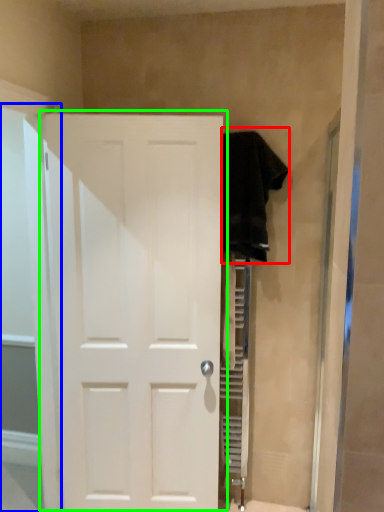
Question: Which object is the closest to the clothing (highlighted by a red box)? Choose among these: glass door (highlighted by a blue box) or door (highlighted by a green box).

Choices:
 (A) glass door
 (B) door

Answer: (B)